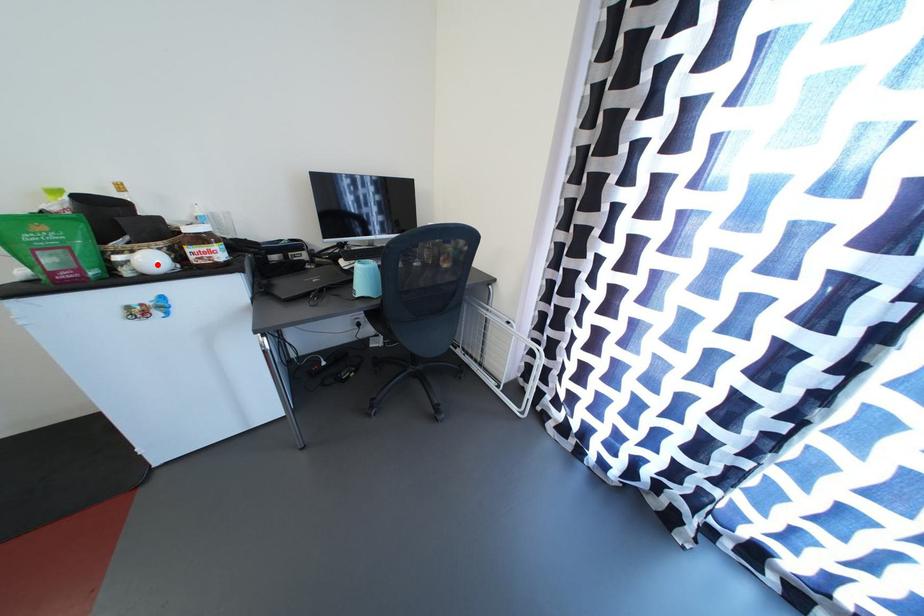
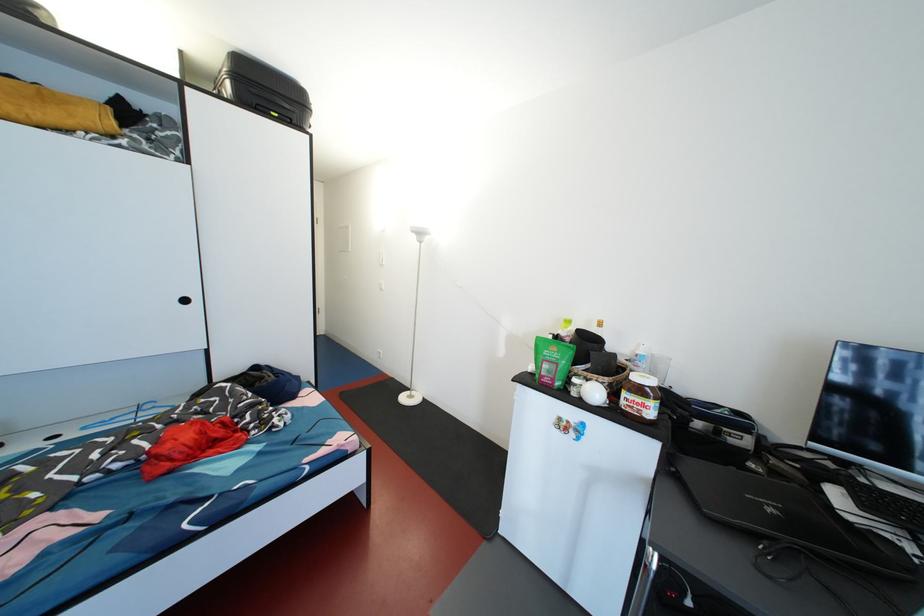
In the second image, find the point that corresponds to the highlighted location in the first image.

(601, 397)